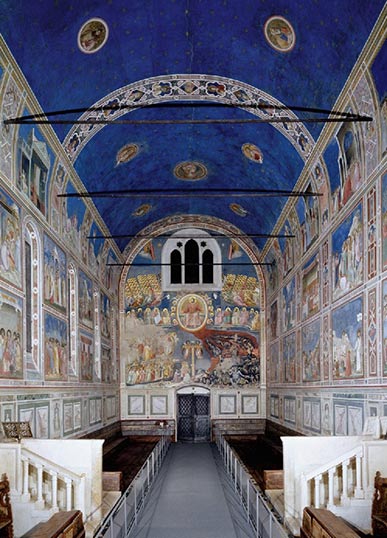
This screenshot has width=387, height=538. I want to click on handrails, so click(50, 463), click(337, 459).